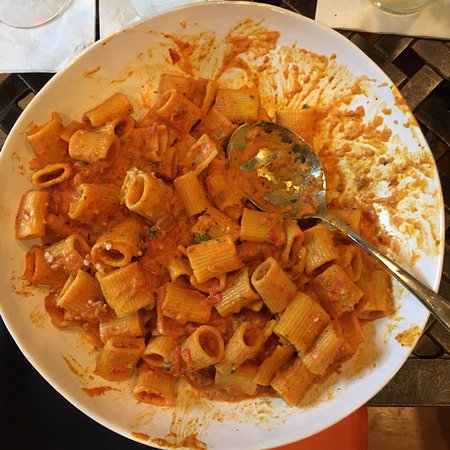
What are the coordinates of `white plate` in the screenshot? It's located at (110, 51).